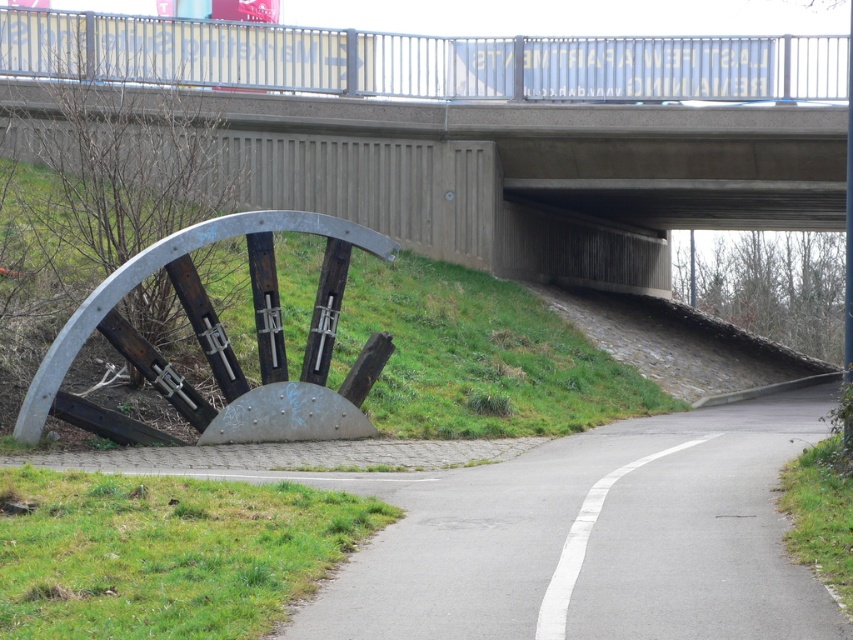
Question: Which of the following is the farthest from the observer?

Choices:
 (A) gray asphalt road at lower center
 (B) concrete bridge at upper center

Answer: (B)

Question: Which object is closer to the camera taking this photo?

Choices:
 (A) concrete bridge at upper center
 (B) gray asphalt road at lower center

Answer: (B)

Question: Can you confirm if concrete bridge at upper center is positioned to the right of gray asphalt road at lower center?

Choices:
 (A) no
 (B) yes

Answer: (B)

Question: Is concrete bridge at upper center bigger than gray asphalt road at lower center?

Choices:
 (A) yes
 (B) no

Answer: (A)

Question: Among these objects, which one is farthest from the camera?

Choices:
 (A) concrete bridge at upper center
 (B) gray asphalt road at lower center

Answer: (A)

Question: Does concrete bridge at upper center appear on the right side of gray asphalt road at lower center?

Choices:
 (A) yes
 (B) no

Answer: (A)